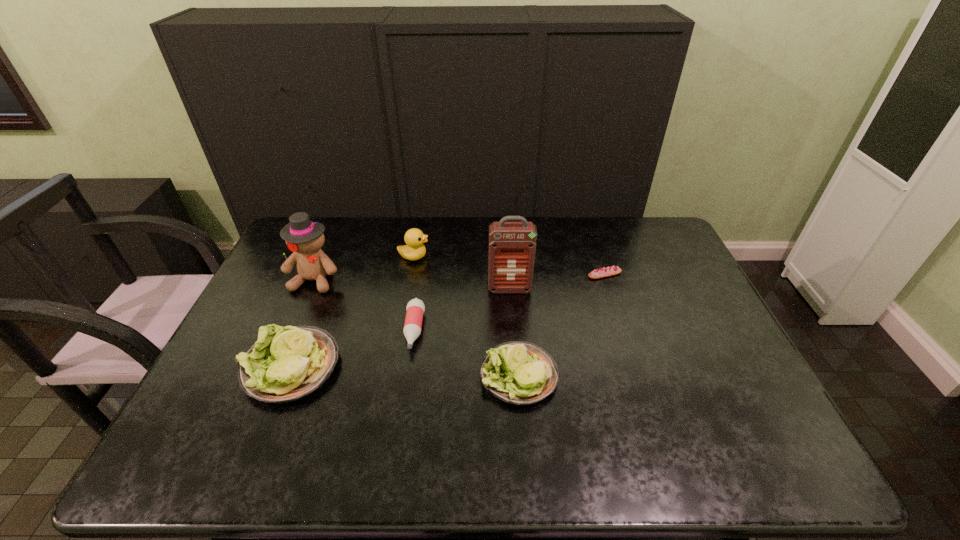
Where is `rag_doll present at the left edge`? rag_doll present at the left edge is located at coordinates (304, 238).

The image size is (960, 540). Identify the location of object that is at the near left corner. (284, 365).

The width and height of the screenshot is (960, 540). What are the coordinates of `vacant area at the far edge of the desktop` in the screenshot? It's located at (428, 227).

The width and height of the screenshot is (960, 540). In the image, there is a desktop. Find the location of `free region at the near edge`. free region at the near edge is located at coordinates (688, 409).

In the image, there is a desktop. Find the location of `vacant space at the left edge`. vacant space at the left edge is located at coordinates (276, 282).

In the image, there is a desktop. Identify the location of vacant space at the right edge. (715, 375).

This screenshot has height=540, width=960. I want to click on vacant space at the near left corner of the desktop, so click(x=204, y=425).

I want to click on vacant area between the tallest object and the taller lettuce, so click(x=400, y=328).

Where is `blank region between the farthest object and the tallest object`? The height and width of the screenshot is (540, 960). blank region between the farthest object and the tallest object is located at coordinates (462, 273).

The image size is (960, 540). Identify the location of free point between the eclair and the first-aid kit. (557, 282).